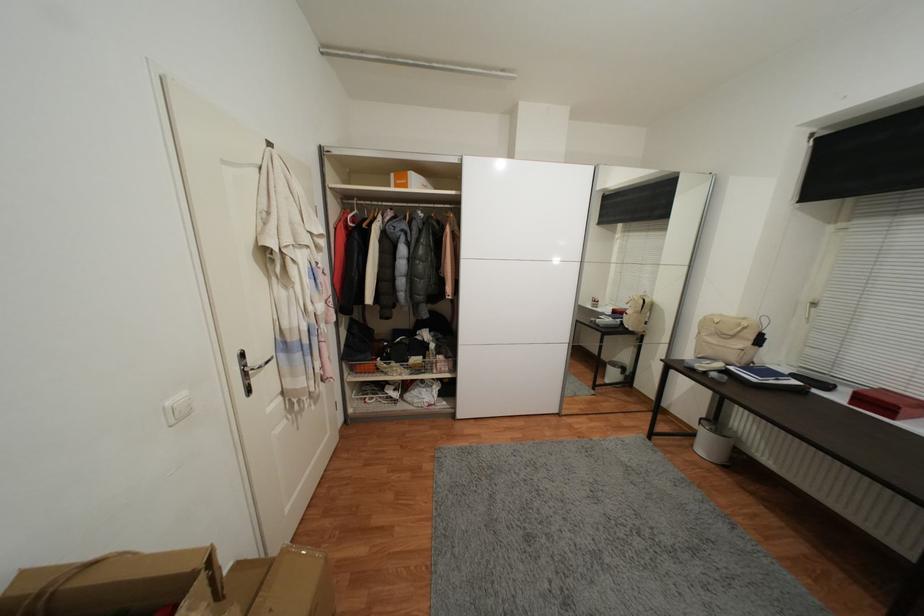
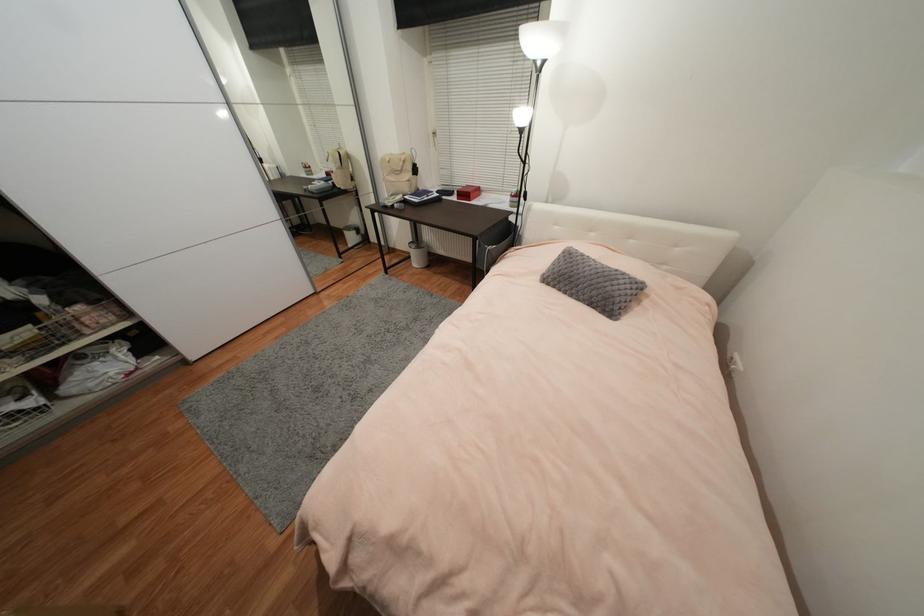
Locate, in the second image, the point that corresponds to point 842,399 in the first image.

(458, 199)